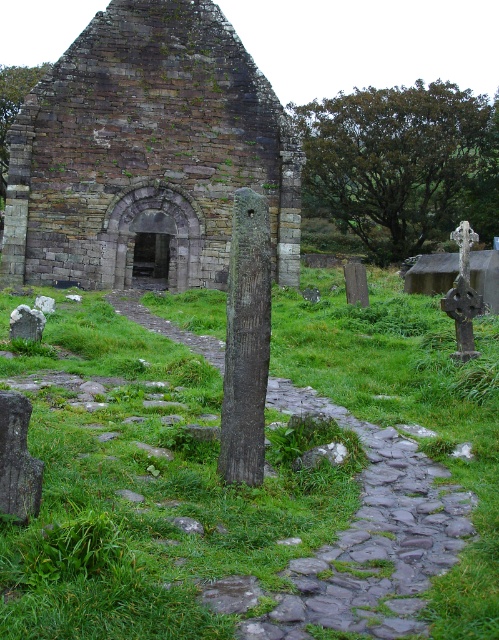
Does rustic stone church at center appear over rough stone path at center?

Correct, rustic stone church at center is located above rough stone path at center.

Can you confirm if rustic stone church at center is positioned to the right of rough stone path at center?

Incorrect, rustic stone church at center is not on the right side of rough stone path at center.

Does point (212, 76) lie in front of point (400, 580)?

That is False.

Where is `rustic stone church at center`? rustic stone church at center is located at coordinates click(x=148, y=156).